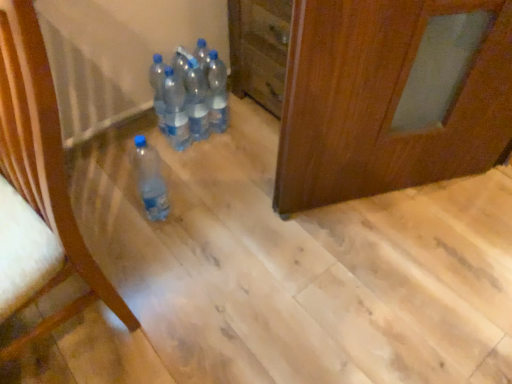
Where is `free space that is in between clear plastic bottle at left and translucent plastic bottle at lower left, acting as the 4th bottle starting from the right`? The width and height of the screenshot is (512, 384). free space that is in between clear plastic bottle at left and translucent plastic bottle at lower left, acting as the 4th bottle starting from the right is located at coordinates (138, 253).